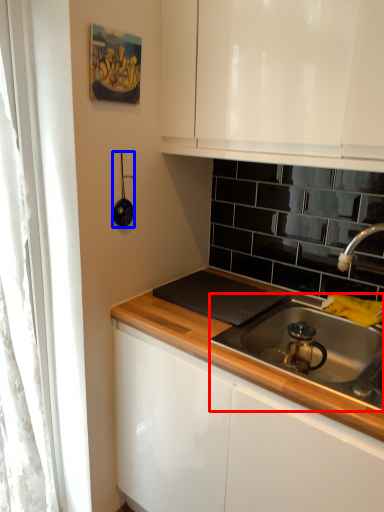
Question: Among these objects, which one is nearest to the camera, gas stove (highlighted by a red box) or appliance (highlighted by a blue box)?

Choices:
 (A) gas stove
 (B) appliance

Answer: (A)